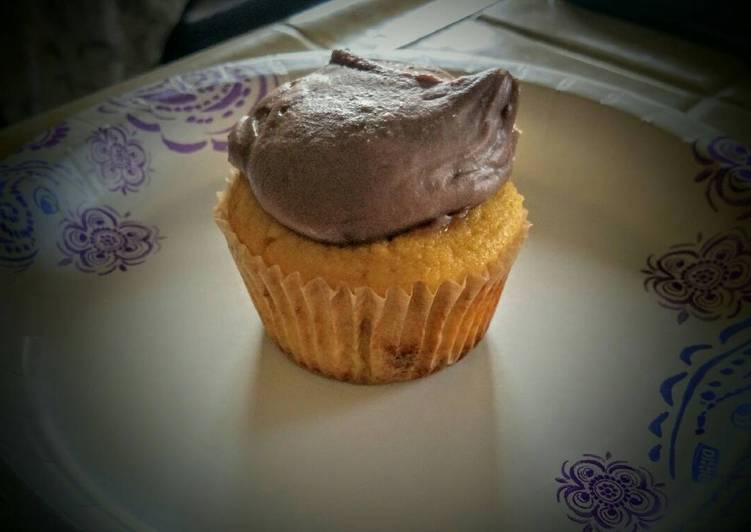
Where is `plate`? Image resolution: width=751 pixels, height=532 pixels. plate is located at coordinates (629, 309).